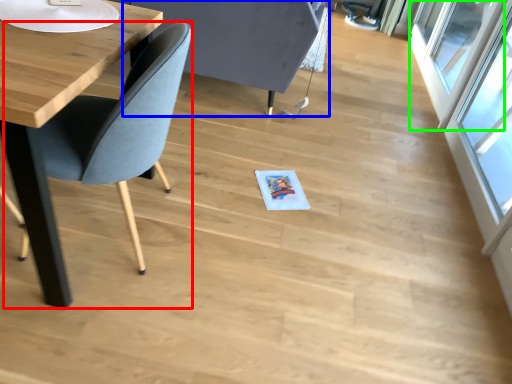
Question: Which object is the closest to the chair (highlighted by a red box)? Choose among these: swivel chair (highlighted by a blue box) or window (highlighted by a green box).

Choices:
 (A) swivel chair
 (B) window

Answer: (A)